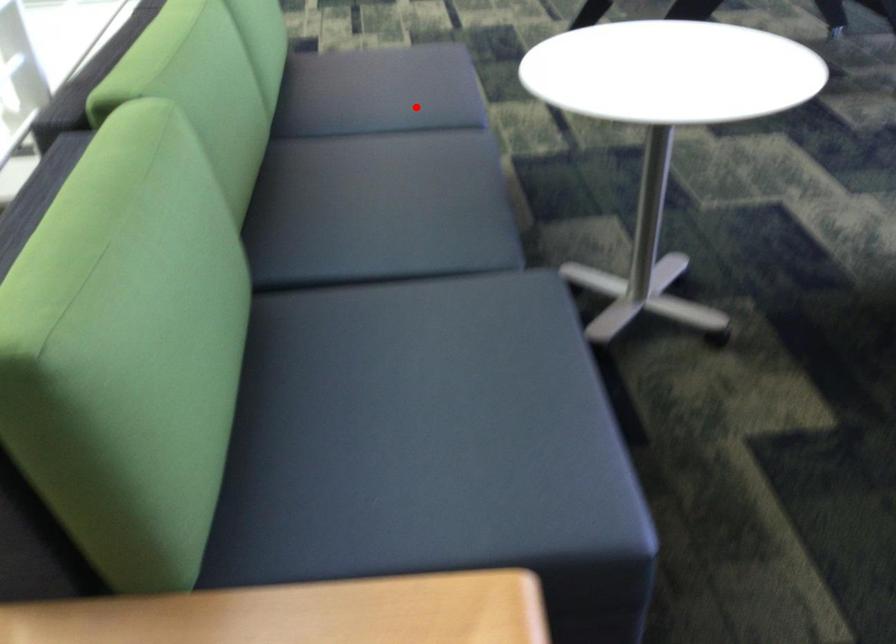
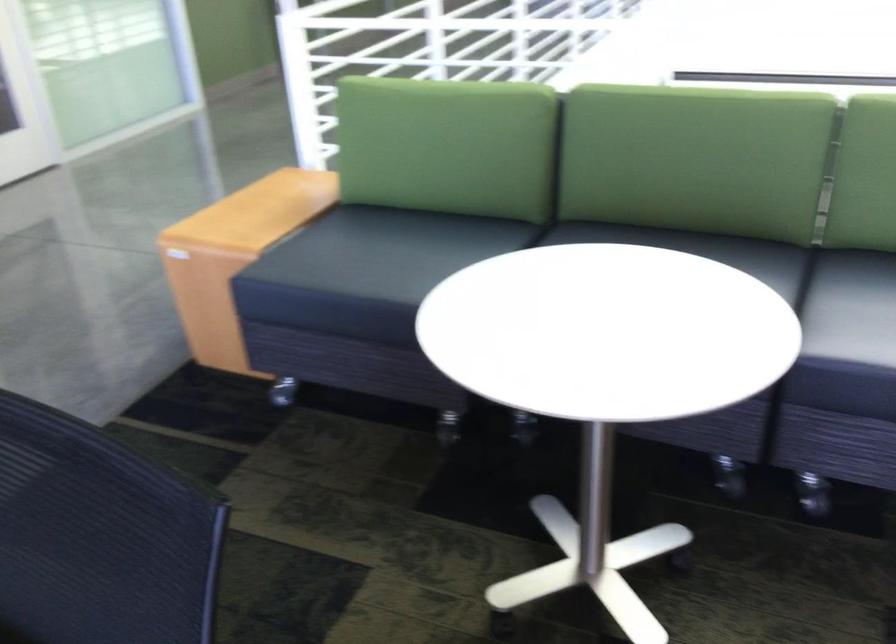
Locate, in the second image, the point that corresponds to the highlighted location in the first image.

(851, 307)